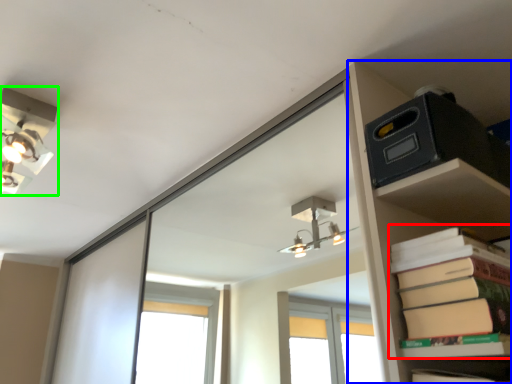
Question: Which object is the closest to the paperback book (highlighted by a red box)? Choose among these: shelf (highlighted by a blue box) or lamp (highlighted by a green box).

Choices:
 (A) shelf
 (B) lamp

Answer: (A)